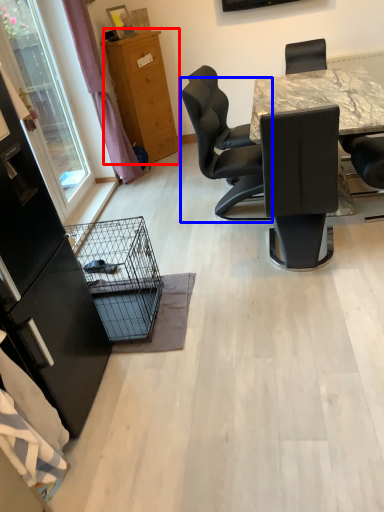
Question: Which object appears farthest to the camera in this image, cabinetry (highlighted by a red box) or chair (highlighted by a blue box)?

Choices:
 (A) cabinetry
 (B) chair

Answer: (A)